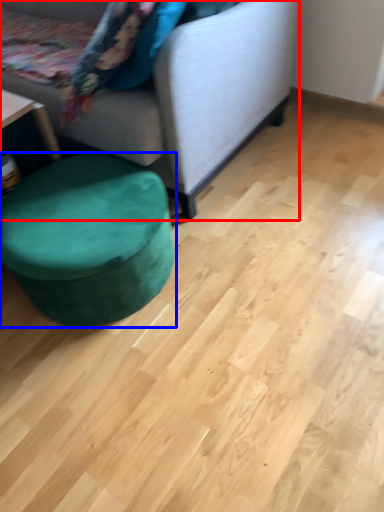
Question: Which of the following is the farthest to the observer, studio couch (highlighted by a red box) or music stool (highlighted by a blue box)?

Choices:
 (A) studio couch
 (B) music stool

Answer: (B)